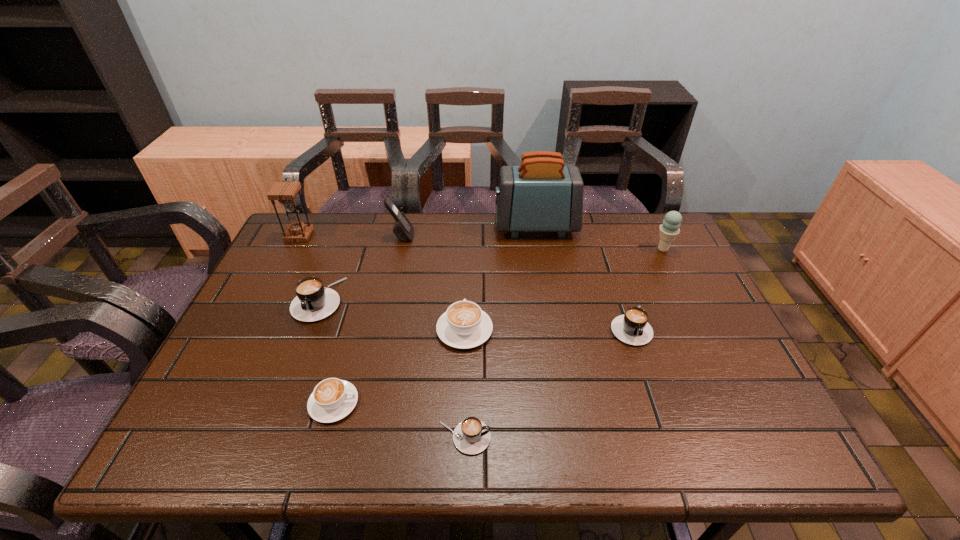
This screenshot has height=540, width=960. What are the coordinates of `vacant area in the image that satisfies the following two spatial constraints: 1. with the handle on the side of the eighth object from left to right; 2. on the side of the nearer white cappuccino with the handle` in the screenshot? It's located at (656, 403).

Where is `vacant area that satisfies the following two spatial constraints: 1. on the front-facing side of the cellular telephone; 2. on the side of the bigger white cappuccino with the handle`? This screenshot has width=960, height=540. vacant area that satisfies the following two spatial constraints: 1. on the front-facing side of the cellular telephone; 2. on the side of the bigger white cappuccino with the handle is located at coordinates (381, 330).

I want to click on vacant point that satisfies the following two spatial constraints: 1. on the front-facing side of the cellular telephone; 2. with the handle on the side of the tallest cappuccino, so click(x=388, y=299).

You are a GUI agent. You are given a task and a screenshot of the screen. Output one action in this format:
    pyautogui.click(x=<x>, y=<y>)
    Task: Click on the blank space that satisfies the following two spatial constraints: 1. on the side of the farther white cappuccino with the handle; 2. on the front-facing side of the cellular telephone
    Image resolution: width=960 pixels, height=540 pixels.
    Given the screenshot: What is the action you would take?
    pyautogui.click(x=468, y=236)

The image size is (960, 540). In order to click on vacant space that satisfies the following two spatial constraints: 1. on the front-facing side of the cellular telephone; 2. on the back side of the blue ice cream in this screenshot , I will do coord(399,249).